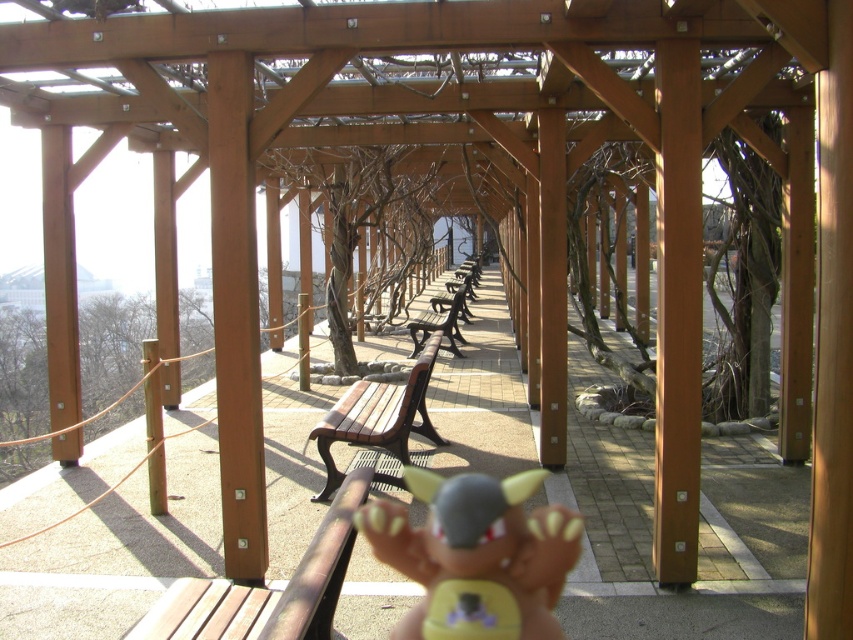
You are a visitor standing at the entrance of the wooden pergola. You see the matte gray plush toy at center and the brown textured tree at center. Which object is taller?

The brown textured tree at center is taller than the matte gray plush toy at center.

You are standing at the entrance of the pergola and see two points marked in the scene. The first point is at coordinate point (433,572) and the second is at point (433,364). Which point is closer to you?

Point (433,572) is in front of point (433,364), so it is closer to you.